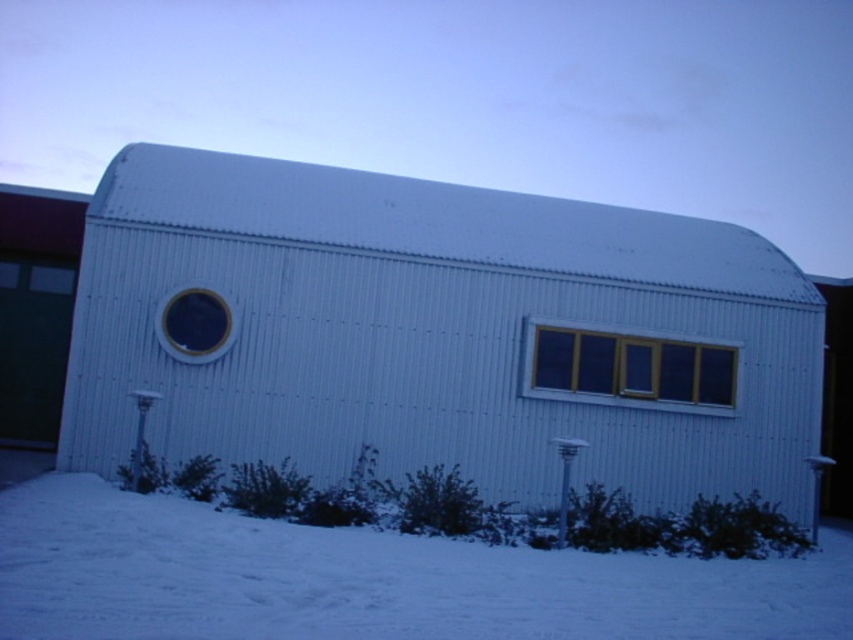
Who is shorter, white powdery snow at lower center or yellow matte window at center?

With less height is white powdery snow at lower center.

From the picture: Is white powdery snow at lower center to the right of yellow matte window at center from the viewer's perspective?

In fact, white powdery snow at lower center is to the left of yellow matte window at center.

Image resolution: width=853 pixels, height=640 pixels. Describe the element at coordinates (370, 580) in the screenshot. I see `white powdery snow at lower center` at that location.

The width and height of the screenshot is (853, 640). I want to click on white powdery snow at lower center, so click(370, 580).

Between white corrugated metal shed at center and matte black circular window at center-left, which one appears on the left side from the viewer's perspective?

matte black circular window at center-left is more to the left.

Which is in front, point (305, 468) or point (181, 310)?

Point (181, 310)

Locate an element on the screen. white corrugated metal shed at center is located at coordinates (444, 332).

Is white corrugated metal shed at center shorter than yellow matte window at center?

No, white corrugated metal shed at center is not shorter than yellow matte window at center.

Who is more distant from viewer, (193,385) or (685,404)?

Point (685,404)

Where is `white corrugated metal shed at center`? This screenshot has height=640, width=853. white corrugated metal shed at center is located at coordinates (444, 332).